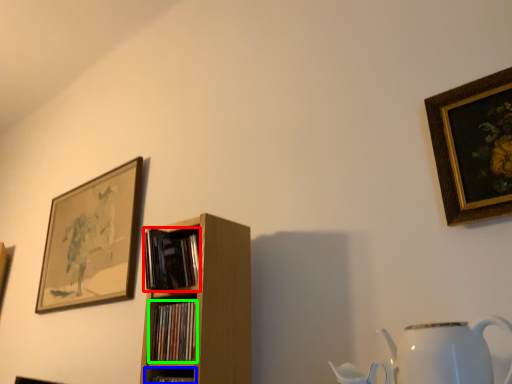
Question: Based on their relative distances, which object is nearer to book (highlighted by a red box)? Choose from shelf (highlighted by a blue box) and book (highlighted by a green box).

Choices:
 (A) shelf
 (B) book

Answer: (B)